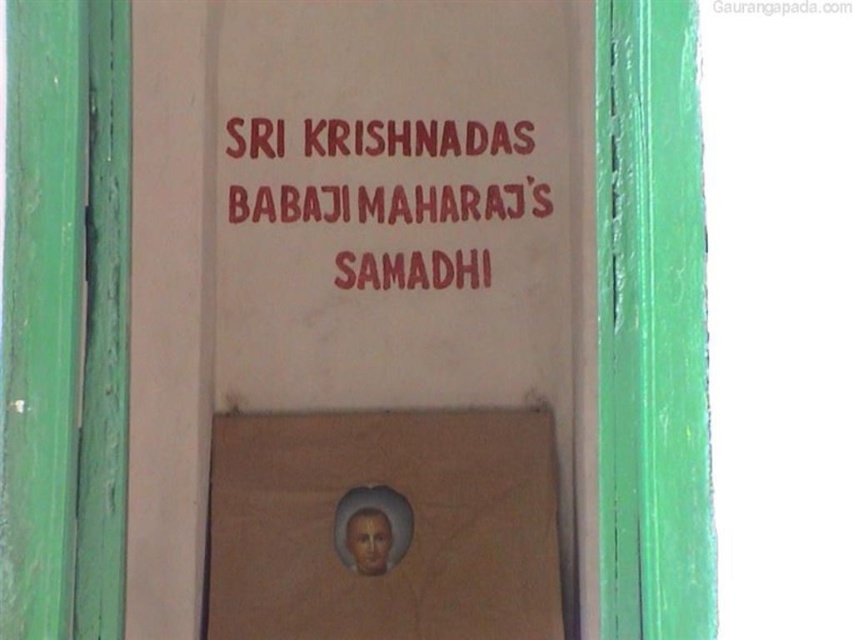
Question: Is brown cardboard at center thinner than red painted text at upper center?

Choices:
 (A) no
 (B) yes

Answer: (A)

Question: Among these points, which one is farthest from the camera?

Choices:
 (A) (285, 572)
 (B) (235, 573)

Answer: (A)

Question: Which of the following is the farthest from the observer?

Choices:
 (A) brown cardboard at center
 (B) white matte signboard at center
 (C) red painted text at upper center

Answer: (C)

Question: Is white matte signboard at center bigger than brown cardboard at center?

Choices:
 (A) yes
 (B) no

Answer: (A)

Question: Which object is farther from the camera taking this photo?

Choices:
 (A) red painted text at upper center
 (B) white matte signboard at center
 (C) brown cardboard at center

Answer: (A)

Question: Observing the image, what is the correct spatial positioning of brown cardboard at center in reference to red painted text at upper center?

Choices:
 (A) above
 (B) below

Answer: (B)